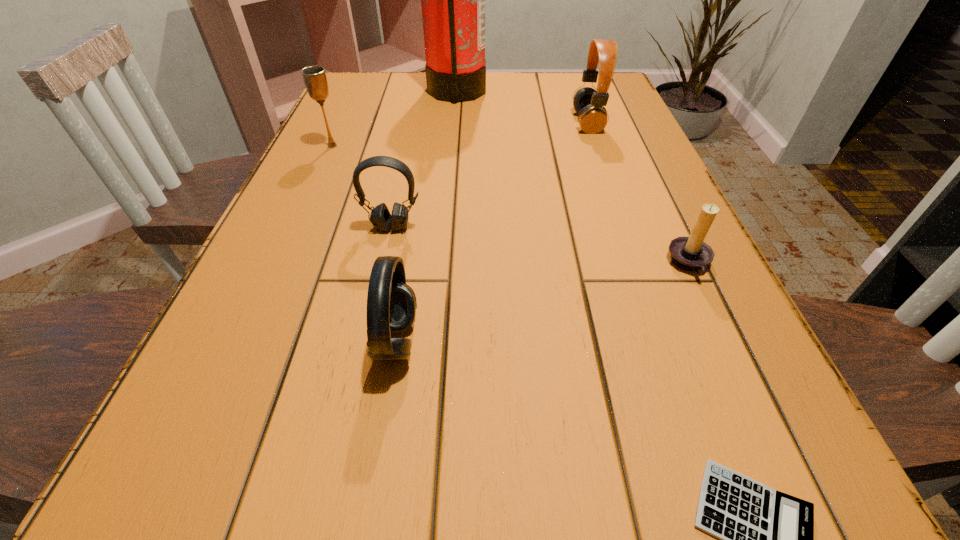
The width and height of the screenshot is (960, 540). I want to click on vacant point located between the fifth nearest object and the nearest headset, so click(365, 244).

The image size is (960, 540). What are the coordinates of `vacant area that lies between the candle holder and the tallest object` in the screenshot? It's located at (573, 178).

The width and height of the screenshot is (960, 540). In order to click on free space between the third nearest object and the fifth nearest object in this screenshot , I will do `click(511, 205)`.

At what (x,y) coordinates should I click in order to perform the action: click on free space between the chalice and the second farthest headset. Please return your answer as a coordinate pair (x, y). Looking at the image, I should click on (362, 186).

What are the coordinates of `blank region between the fire extinguisher and the nearest headset` in the screenshot? It's located at (426, 217).

Identify which object is the second closest to the calculator. Please provide its 2D coordinates. Your answer should be formatted as a tuple, i.e. [(x, y)], where the tuple contains the x and y coordinates of a point satisfying the conditions above.

[(391, 304)]

You are a GUI agent. You are given a task and a screenshot of the screen. Output one action in this format:
    pyautogui.click(x=<x>, y=<y>)
    Task: Click on the object identified as the fifth closest to the third farthest object
    The image size is (960, 540).
    Given the screenshot: What is the action you would take?
    pyautogui.click(x=690, y=253)

At what (x,y) coordinates should I click in order to perform the action: click on the second closest headset to the candle holder. Please return your answer as a coordinate pair (x, y). The image size is (960, 540). Looking at the image, I should click on (391, 304).

The image size is (960, 540). What are the coordinates of `headset that is the closest one to the tallest headset` in the screenshot? It's located at pos(380,217).

I want to click on vacant space that satisfies the following two spatial constraints: 1. on the front side of the tallest object; 2. on the front-facing side of the second farthest headset, so click(445, 227).